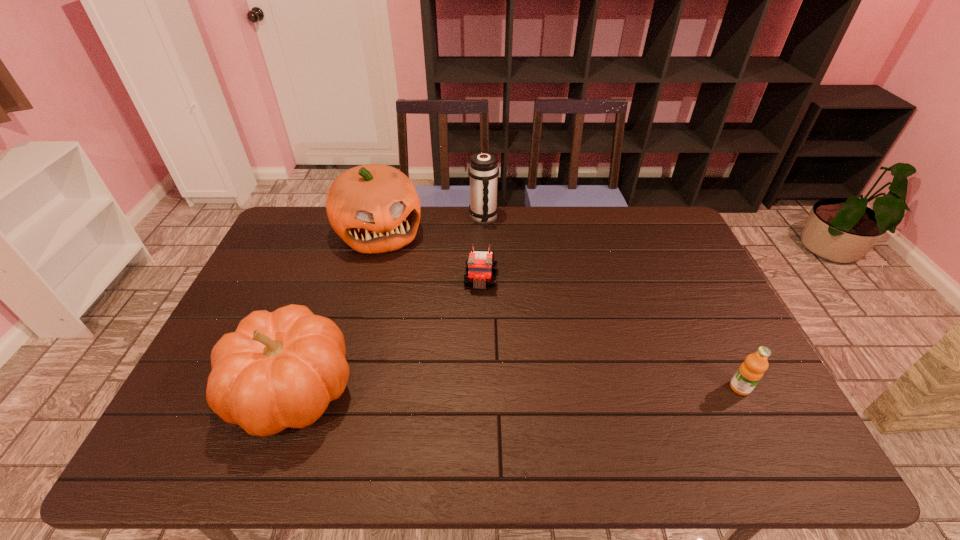
This screenshot has height=540, width=960. I want to click on vacant space on the desktop that is between the nearer pumpkin and the orange juice and is positioned on the front-facing side of the Lego, so click(471, 389).

The height and width of the screenshot is (540, 960). Find the location of `vacant space on the desktop that is between the nearer pumpkin and the orange juice and is positioned on the face of the farther pumpkin`. vacant space on the desktop that is between the nearer pumpkin and the orange juice and is positioned on the face of the farther pumpkin is located at coordinates (451, 389).

The height and width of the screenshot is (540, 960). I want to click on vacant space on the desktop that is between the nearer pumpkin and the fourth tallest object and is positioned on the side with the handle of the thermos bottle, so click(573, 388).